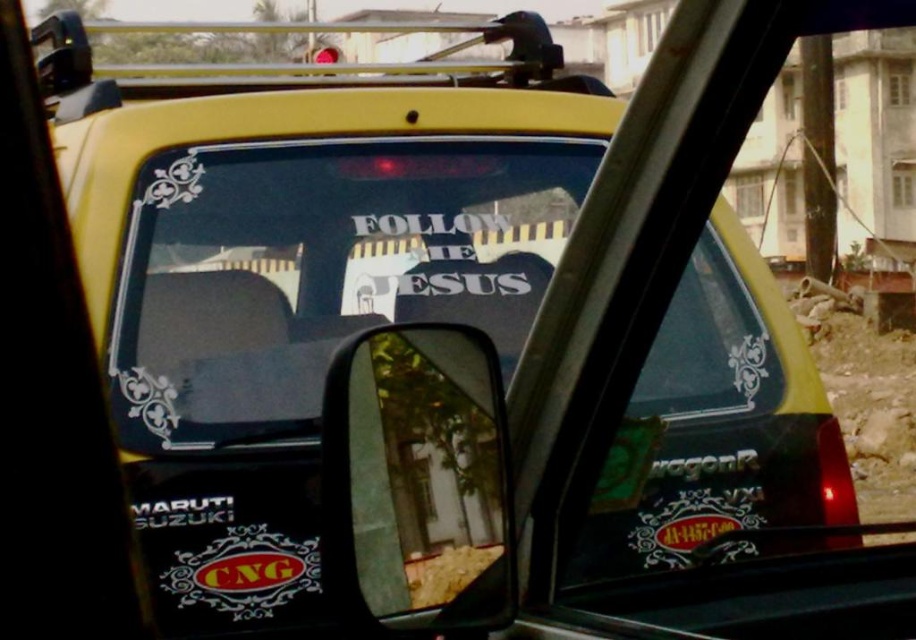
You are a delivery driver who needs to attach a new sticker to your car. You have two items in your hand, a transparent vinyl sticker at center and a clear plastic mirror at center. Which item has a greater width?

The transparent vinyl sticker at center has a greater width than the clear plastic mirror at center according to the description.

Looking at this image, you are a delivery driver who needs to ensure that your vehicle is visible to other drivers. You notice the transparent vinyl sticker at center and the clear plastic mirror at center on your Maruti Suzuki WagonR. Which object might obstruct the rear view more due to its size?

The transparent vinyl sticker at center is much taller than the clear plastic mirror at center, so it might obstruct the rear view more due to its size.